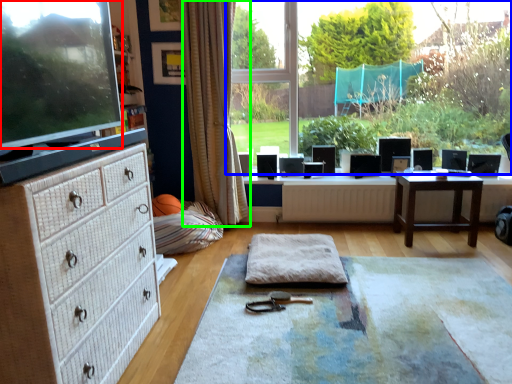
Question: Which is nearer to the computer monitor (highlighted by a red box)? window (highlighted by a blue box) or curtain (highlighted by a green box).

Choices:
 (A) window
 (B) curtain

Answer: (B)